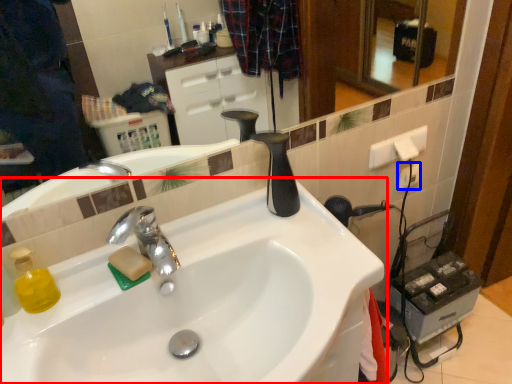
Question: Which object appears farthest to the camera in this image, sink (highlighted by a red box) or electric outlet (highlighted by a blue box)?

Choices:
 (A) sink
 (B) electric outlet

Answer: (B)